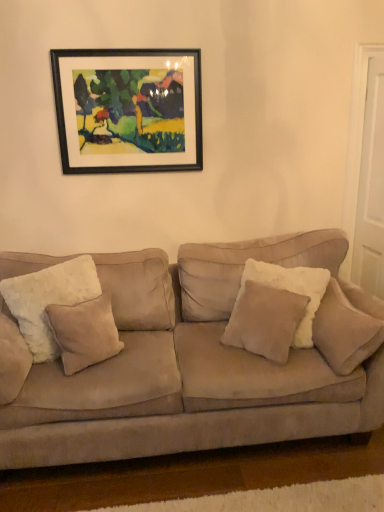
Question: From the image's perspective, is white matte door at right above or below beige suede couch at center?

Choices:
 (A) above
 (B) below

Answer: (A)

Question: Looking at the image, does white matte door at right seem bigger or smaller compared to beige suede couch at center?

Choices:
 (A) small
 (B) big

Answer: (A)

Question: Estimate the real-world distances between objects in this image. Which object is farther from the white matte door at right?

Choices:
 (A) white fluffy pillow at left, positioned as the fourth pillow in right-to-left order
 (B) beige suede pillow at right, the 4th pillow from the left
 (C) beige suede pillow at left, placed as the 3th pillow when sorted from right to left
 (D) beige suede pillow at center, which is the 3th pillow from left to right
 (E) black wood picture frame at upper center

Answer: (A)

Question: Which object is positioned farthest from the white fluffy pillow at left, placed as the 1th pillow when sorted from left to right?

Choices:
 (A) white matte door at right
 (B) black wood picture frame at upper center
 (C) beige suede pillow at left, placed as the 3th pillow when sorted from right to left
 (D) beige suede couch at center
 (E) beige suede pillow at right, positioned as the 1th pillow in right-to-left order

Answer: (A)